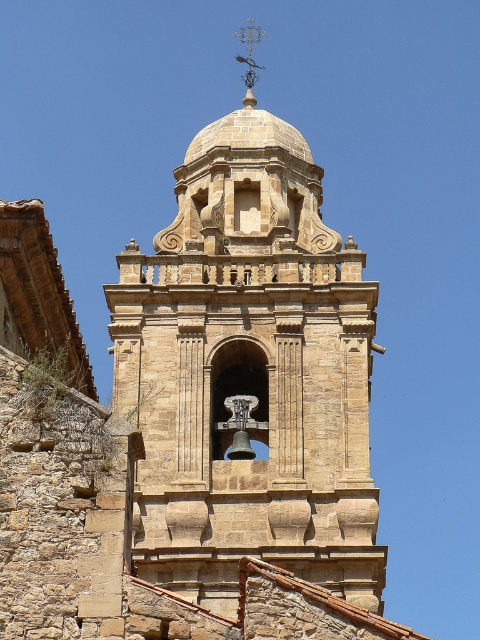
Question: Does brown stone bell tower at center appear under metallic weather vane at upper center?

Choices:
 (A) yes
 (B) no

Answer: (A)

Question: Among these points, which one is farthest from the camera?

Choices:
 (A) (255, 308)
 (B) (263, 67)

Answer: (B)

Question: Is brown stone bell tower at center closer to the viewer compared to metallic weather vane at upper center?

Choices:
 (A) no
 (B) yes

Answer: (B)

Question: Which point is farther to the camera?

Choices:
 (A) (285, 552)
 (B) (252, 72)

Answer: (B)

Question: Which object is farther from the camera taking this photo?

Choices:
 (A) brown stone bell tower at center
 (B) metallic weather vane at upper center

Answer: (B)

Question: Does brown stone bell tower at center appear on the right side of metallic weather vane at upper center?

Choices:
 (A) no
 (B) yes

Answer: (A)